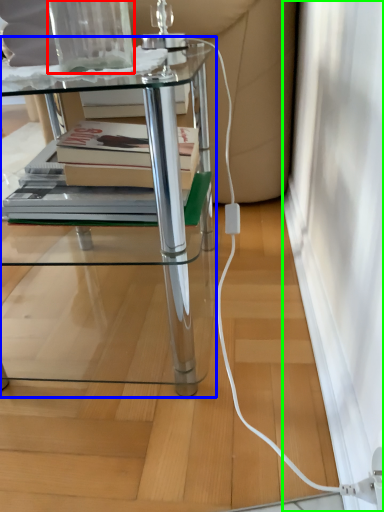
Question: Based on their relative distances, which object is farther from glass vase (highlighted by a red box)? Choose from table (highlighted by a blue box) and screen door (highlighted by a green box).

Choices:
 (A) table
 (B) screen door

Answer: (B)